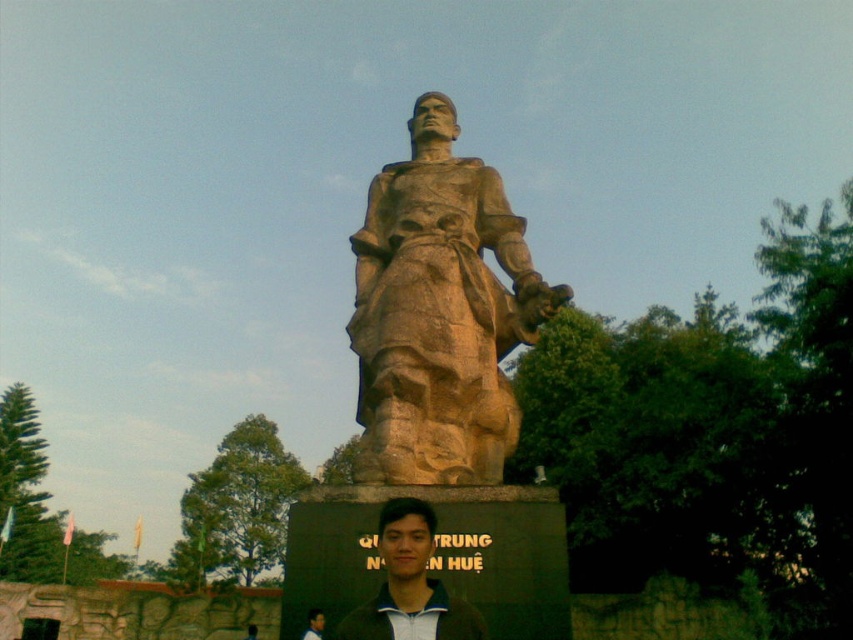
You are a tour guide explaining the statue to visitors. You point to two points on the statue. The first point is at coordinates point (451, 291) and the second is at point (314, 614). Which point is closer to the front of the statue?

Point (314, 614) is closer to the front of the statue because it is in front of point (451, 291).

You are an artist trying to sketch this statue. You notice the dark brown leather jacket at lower center and the dark green hair at center. Which object takes up more area in your drawing?

The dark green hair at center occupies more space than the dark brown leather jacket at lower center, so it will take up more area in the drawing.

You are a tourist standing in front of the statue and want to take a photo of the point at coordinates (439, 312). Where exactly on the statue should you aim your camera?

The point at coordinates (439, 312) is located on the brown stone statue at center, so you should aim your camera at the center of the statue to capture that point.